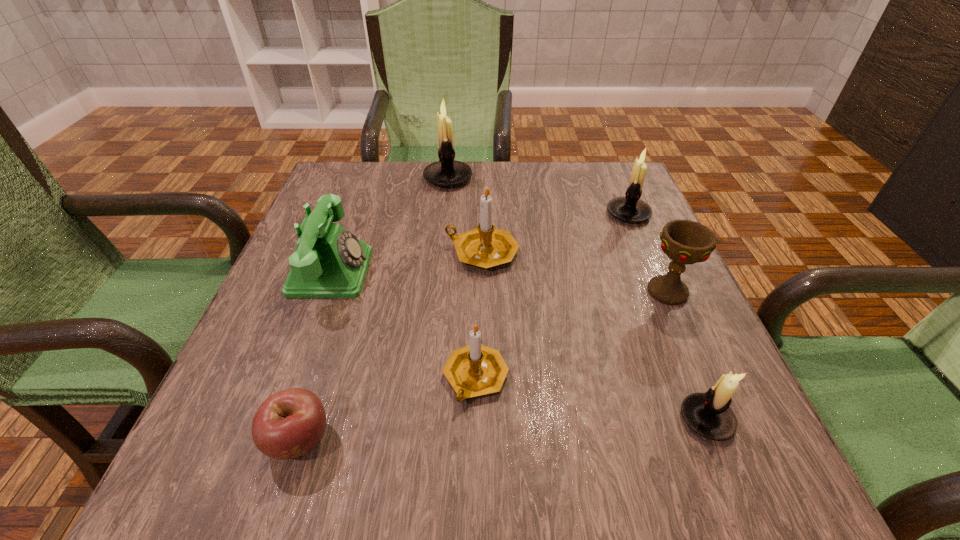
Identify the location of the shortest object. This screenshot has width=960, height=540. (288, 424).

Image resolution: width=960 pixels, height=540 pixels. In order to click on vacant space positioned 0.340m on the right of the tallest candle holder in this screenshot , I will do `click(598, 178)`.

At what (x,y) coordinates should I click in order to perform the action: click on free location located on the front of the seventh nearest object. Please return your answer as a coordinate pair (x, y). The height and width of the screenshot is (540, 960). Looking at the image, I should click on (677, 328).

I want to click on vacant position located 0.240m on the front of the bigger gold candle holder, so click(x=483, y=373).

Locate an element on the screen. vacant space located 0.090m on the dial of the telephone is located at coordinates (411, 272).

The image size is (960, 540). I want to click on free space located on the back of the red chalice, so click(635, 216).

The image size is (960, 540). I want to click on vacant region located 0.260m on the back of the smaller gold candle holder, so click(x=476, y=253).

Image resolution: width=960 pixels, height=540 pixels. Find the location of `free point located 0.390m on the back of the smallest white candle holder`. free point located 0.390m on the back of the smallest white candle holder is located at coordinates (635, 244).

Locate an element on the screen. candle holder situated at the near edge is located at coordinates (708, 414).

This screenshot has height=540, width=960. In order to click on apple that is at the near edge in this screenshot , I will do `click(288, 424)`.